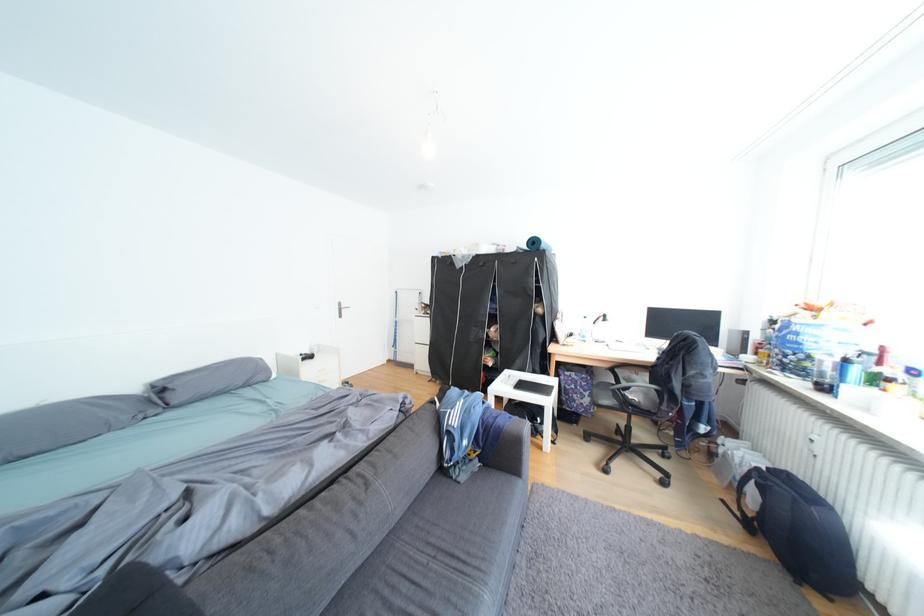
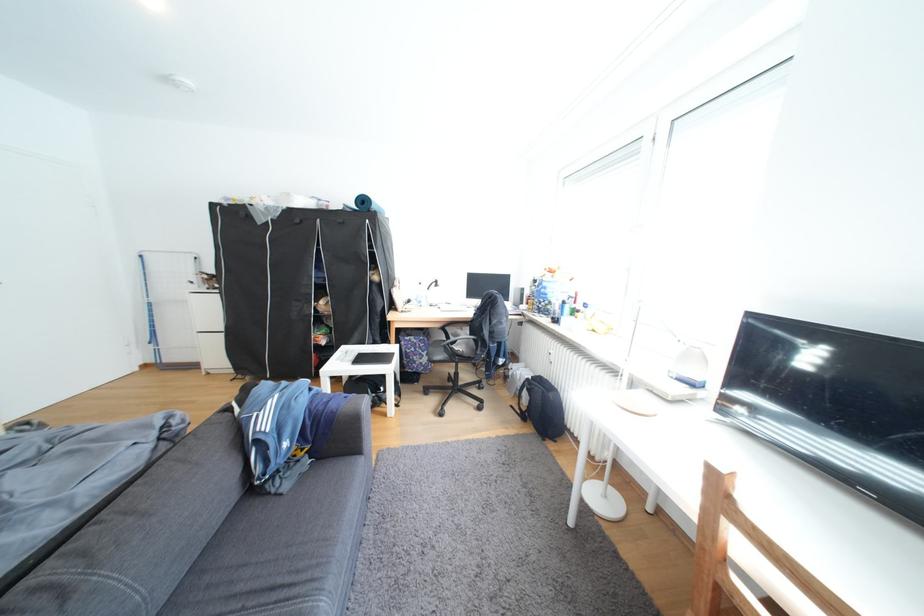
Question: The images are taken continuously from a first-person perspective. In which direction is your viewpoint rotating?

Choices:
 (A) Left
 (B) Right
 (C) Up
 (D) Down

Answer: (B)